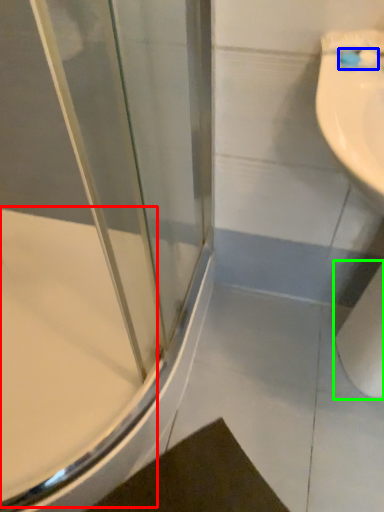
Question: Which object is positioned closest to bath (highlighted by a red box)? Select from toothbrush (highlighted by a blue box) and toilet paper (highlighted by a green box).

Choices:
 (A) toothbrush
 (B) toilet paper

Answer: (B)